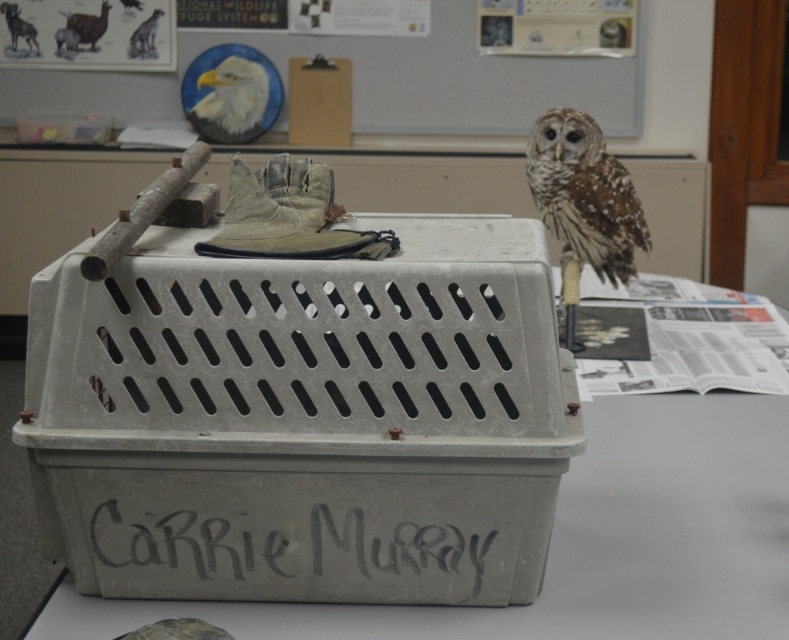
Looking at this image, you are a wildlife handler preparing to place a protective barrier between the camera and the point at coordinates (746,516). If the barrier needs to be at least 5 feet long to cover the distance, will it be sufficient?

The distance between the camera and the point (746,516) is 4.22 feet. Since the required barrier length is 5 feet, the barrier will be longer than needed and thus sufficient.

You are a volunteer at the wildlife center and need to retrieve an item from the gray plastic crate at center. However, there are brown speckled feathers at upper right present. What should you be cautious about when reaching into the crate?

You should be cautious of the brown speckled feathers at upper right because the gray plastic crate at center is located below them, which might mean the feathers could belong to an animal in or near the crate.